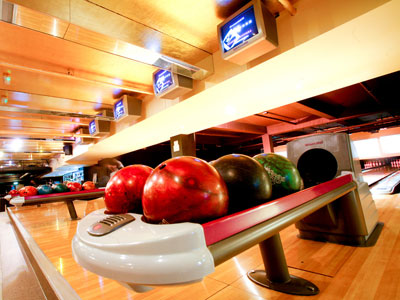
Identify the location of monitors. Image resolution: width=400 pixels, height=300 pixels. (x=242, y=23), (x=157, y=81), (x=118, y=107), (x=96, y=127).